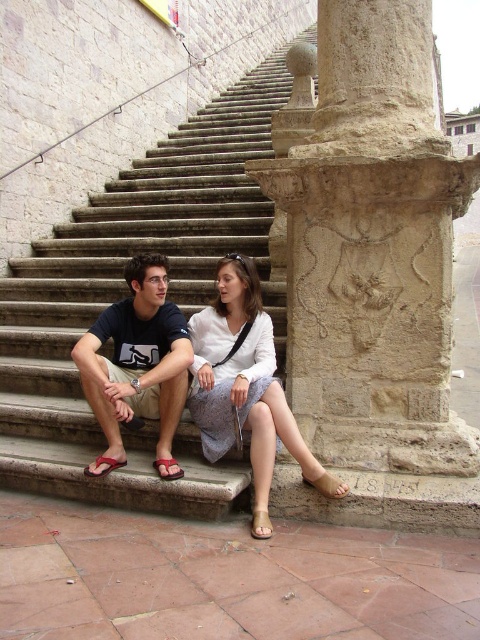
Does stone textured column at right appear on the right side of light blue fabric dress at center?

Correct, you'll find stone textured column at right to the right of light blue fabric dress at center.

Does stone textured column at right have a smaller size compared to light blue fabric dress at center?

No, stone textured column at right is not smaller than light blue fabric dress at center.

Find the location of `stone textured column at right`. stone textured column at right is located at coordinates (373, 248).

Is stone stairs at center bigger than dark blue t-shirt at lower center?

Answer: Indeed, stone stairs at center has a larger size compared to dark blue t-shirt at lower center.

Consider the image. Is stone stairs at center shorter than dark blue t-shirt at lower center?

No.

Does point (263, 266) come behind point (120, 364)?

That is True.

Locate an element on the screen. The width and height of the screenshot is (480, 640). stone stairs at center is located at coordinates (128, 292).

Which is above, light blue fabric dress at center or dark blue t-shirt at lower center?

dark blue t-shirt at lower center

Is light blue fabric dress at center taller than dark blue t-shirt at lower center?

Correct, light blue fabric dress at center is much taller as dark blue t-shirt at lower center.

Is point (255, 492) behind point (166, 307)?

No, (255, 492) is in front of (166, 307).

You are a GUI agent. You are given a task and a screenshot of the screen. Output one action in this format:
    pyautogui.click(x=<x>, y=<y>)
    Task: Click on the light blue fabric dress at center
    The height and width of the screenshot is (640, 480).
    Given the screenshot: What is the action you would take?
    pyautogui.click(x=245, y=387)